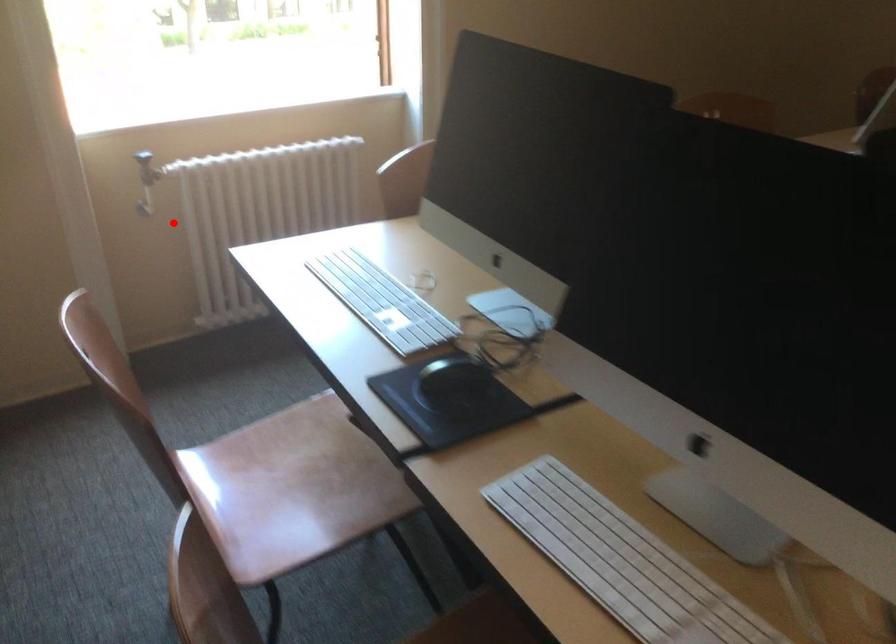
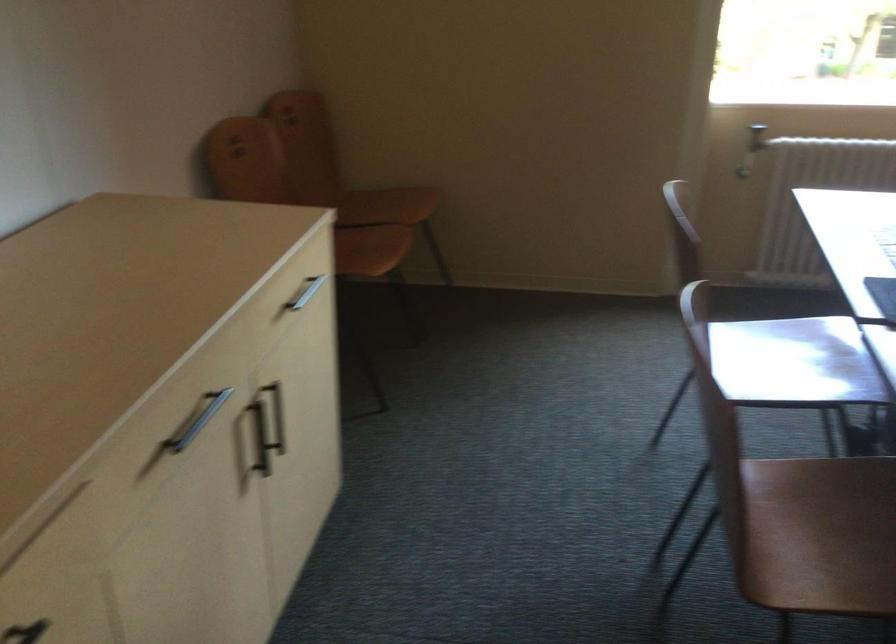
Locate, in the second image, the point that corresponds to the highlighted location in the first image.

(743, 172)